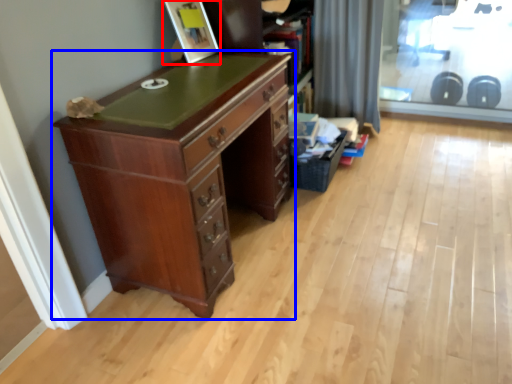
Question: Which of the following is the closest to the observer, picture frame (highlighted by a red box) or chest of drawers (highlighted by a blue box)?

Choices:
 (A) picture frame
 (B) chest of drawers

Answer: (B)